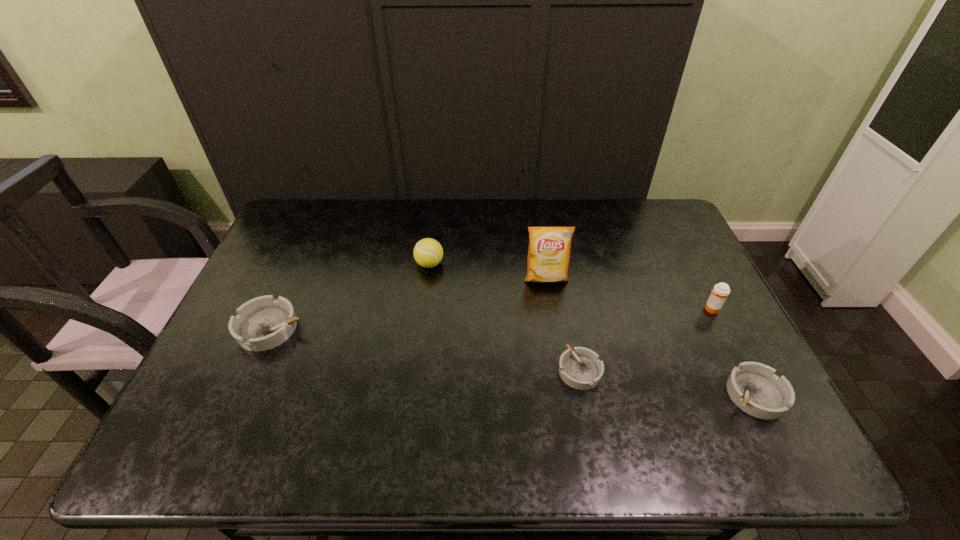
Where is `free spot between the tennis ball and the shortest ashtray`? free spot between the tennis ball and the shortest ashtray is located at coordinates (505, 317).

Find the location of `free space between the fifth object from right to left and the tallest object`. free space between the fifth object from right to left and the tallest object is located at coordinates (488, 271).

The height and width of the screenshot is (540, 960). I want to click on empty location between the shortest ashtray and the leftmost ashtray, so click(x=425, y=349).

This screenshot has height=540, width=960. What are the coordinates of `unoccupied area between the fourth tallest object and the tennis ball` in the screenshot? It's located at (350, 296).

Image resolution: width=960 pixels, height=540 pixels. I want to click on free space between the shortest object and the fifth object from right to left, so click(505, 317).

Where is `the second closest object to the medicine`? This screenshot has width=960, height=540. the second closest object to the medicine is located at coordinates (580, 368).

Locate which object is the fifth closest to the rightmost ashtray. Please provide its 2D coordinates. Your answer should be formatted as a tuple, i.e. [(x, y)], where the tuple contains the x and y coordinates of a point satisfying the conditions above.

[(263, 323)]

Point out which ashtray is positioned as the second nearest to the rightmost ashtray. Please provide its 2D coordinates. Your answer should be formatted as a tuple, i.e. [(x, y)], where the tuple contains the x and y coordinates of a point satisfying the conditions above.

[(263, 323)]

Image resolution: width=960 pixels, height=540 pixels. I want to click on ashtray identified as the second closest to the tallest object, so click(752, 386).

At what (x,y) coordinates should I click in order to perform the action: click on vacant space that satisfies the following two spatial constraints: 1. on the back side of the fourth tallest object; 2. on the right side of the medicine. Please return your answer as a coordinate pair (x, y). This screenshot has width=960, height=540. Looking at the image, I should click on (279, 309).